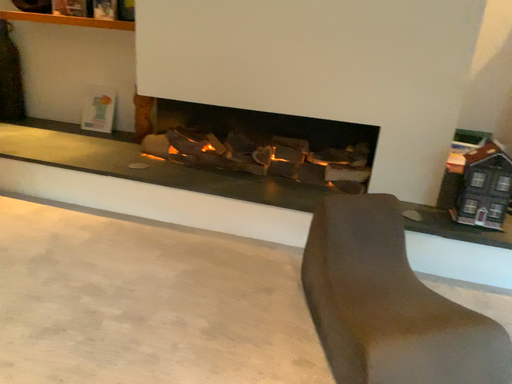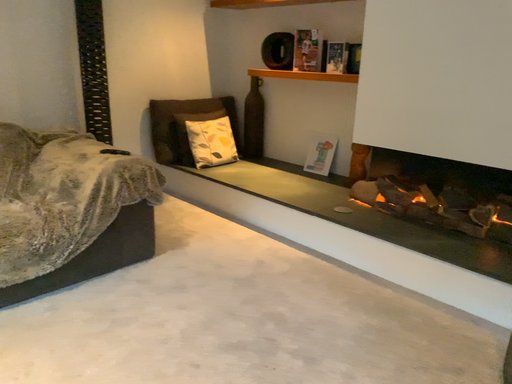
Question: Which way did the camera rotate in the video?

Choices:
 (A) rotated downward
 (B) rotated upward

Answer: (B)